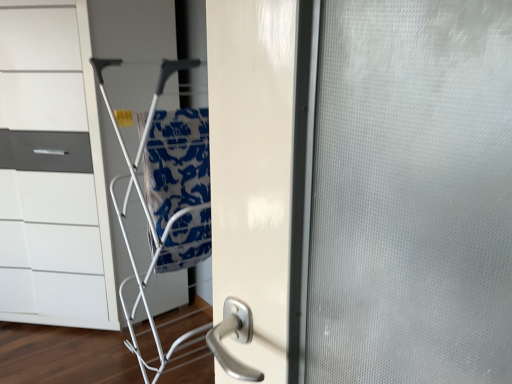
Question: Is white glossy chest of drawers at left shorter than silver metallic door handle at center?

Choices:
 (A) no
 (B) yes

Answer: (A)

Question: Considering the relative sizes of white glossy chest of drawers at left and silver metallic door handle at center in the image provided, is white glossy chest of drawers at left smaller than silver metallic door handle at center?

Choices:
 (A) yes
 (B) no

Answer: (B)

Question: Considering the relative positions of white glossy chest of drawers at left and silver metallic door handle at center in the image provided, is white glossy chest of drawers at left to the right of silver metallic door handle at center from the viewer's perspective?

Choices:
 (A) yes
 (B) no

Answer: (B)

Question: Is white glossy chest of drawers at left completely or partially outside of silver metallic door handle at center?

Choices:
 (A) no
 (B) yes

Answer: (B)

Question: Is white glossy chest of drawers at left at the left side of silver metallic door handle at center?

Choices:
 (A) yes
 (B) no

Answer: (A)

Question: Is blue printed fabric at center inside or outside of white glossy chest of drawers at left?

Choices:
 (A) inside
 (B) outside

Answer: (B)

Question: Considering the relative positions of blue printed fabric at center and white glossy chest of drawers at left in the image provided, is blue printed fabric at center to the left or to the right of white glossy chest of drawers at left?

Choices:
 (A) right
 (B) left

Answer: (A)

Question: From their relative heights in the image, would you say blue printed fabric at center is taller or shorter than white glossy chest of drawers at left?

Choices:
 (A) short
 (B) tall

Answer: (A)

Question: Is point (166, 198) positioned closer to the camera than point (49, 268)?

Choices:
 (A) farther
 (B) closer

Answer: (B)

Question: Visually, is white glossy chest of drawers at left positioned to the left or to the right of silver metallic door handle at center?

Choices:
 (A) right
 (B) left

Answer: (B)

Question: Relative to silver metallic door handle at center, is white glossy chest of drawers at left in front or behind?

Choices:
 (A) front
 (B) behind

Answer: (A)

Question: In terms of height, does white glossy chest of drawers at left look taller or shorter compared to silver metallic door handle at center?

Choices:
 (A) short
 (B) tall

Answer: (B)

Question: Is white glossy chest of drawers at left wider or thinner than silver metallic door handle at center?

Choices:
 (A) thin
 (B) wide

Answer: (B)

Question: Is silver metallic door handle at center taller or shorter than white glossy chest of drawers at left?

Choices:
 (A) short
 (B) tall

Answer: (A)

Question: From a real-world perspective, is silver metallic door handle at center physically located above or below white glossy chest of drawers at left?

Choices:
 (A) below
 (B) above

Answer: (A)